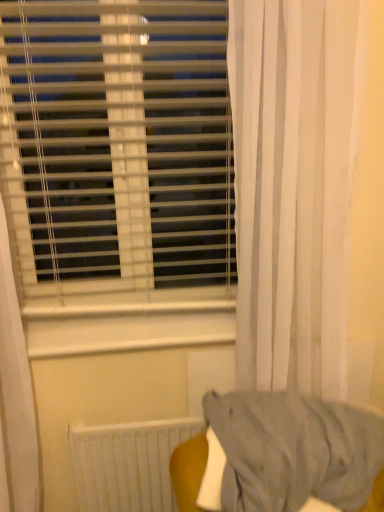
Image resolution: width=384 pixels, height=512 pixels. What are the coordinates of `white matte radiator at lower center` in the screenshot? It's located at (128, 464).

What is the approximate height of white sheer curtain at right?

white sheer curtain at right is 1.09 meters in height.

What are the coordinates of `white matte radiator at lower center` in the screenshot? It's located at (128, 464).

Is white sheer curtain at right spatially inside white matte radiator at lower center, or outside of it?

white sheer curtain at right is not inside white matte radiator at lower center, it's outside.

Which object is positioned more to the left, white sheer curtain at right or white matte radiator at lower center?

Positioned to the left is white matte radiator at lower center.

Does white sheer curtain at right have a lesser height compared to white matte radiator at lower center?

Incorrect, the height of white sheer curtain at right does not fall short of that of white matte radiator at lower center.

Is the depth of white sheer curtain at right greater than that of white matte radiator at lower center?

No, the depth of white sheer curtain at right is less than that of white matte radiator at lower center.

From the image's perspective, which one is positioned lower, white matte radiator at lower center or white plastic blinds at upper left?

white matte radiator at lower center is shown below in the image.

I want to click on radiator located on the right of white plastic blinds at upper left, so click(x=128, y=464).

How different are the orientations of white matte radiator at lower center and white plastic blinds at upper left in degrees?

The angular difference between white matte radiator at lower center and white plastic blinds at upper left is 0.33 degrees.

Considering the relative sizes of white matte radiator at lower center and white plastic blinds at upper left in the image provided, is white matte radiator at lower center thinner than white plastic blinds at upper left?

Incorrect, the width of white matte radiator at lower center is not less than that of white plastic blinds at upper left.

Is white sheer curtain at right to the left of white plastic blinds at upper left from the viewer's perspective?

Incorrect, white sheer curtain at right is not on the left side of white plastic blinds at upper left.

What's the angular difference between white sheer curtain at right and white plastic blinds at upper left's facing directions?

The angle between the facing direction of white sheer curtain at right and the facing direction of white plastic blinds at upper left is 2.77 degrees.

Is white sheer curtain at right outside of white plastic blinds at upper left?

Yes, white sheer curtain at right is not within white plastic blinds at upper left.

Which is more distant, (x=333, y=72) or (x=121, y=55)?

The point (x=121, y=55) is farther from the camera.

Considering the relative sizes of white matte radiator at lower center and white sheer curtain at right in the image provided, is white matte radiator at lower center shorter than white sheer curtain at right?

Correct, white matte radiator at lower center is not as tall as white sheer curtain at right.

Between white matte radiator at lower center and white sheer curtain at right, which one appears on the left side from the viewer's perspective?

white matte radiator at lower center.

Is white matte radiator at lower center aimed at white sheer curtain at right?

No.

You are a GUI agent. You are given a task and a screenshot of the screen. Output one action in this format:
    pyautogui.click(x=<x>, y=<y>)
    Task: Click on the window blind located above the white matte radiator at lower center (from a real-world perspective)
    The width and height of the screenshot is (384, 512).
    Given the screenshot: What is the action you would take?
    [117, 145]

Are white plastic blinds at upper left and white matte radiator at lower center located far from each other?

No, white plastic blinds at upper left is not far away from white matte radiator at lower center.

Does point (55, 215) appear closer or farther from the camera than point (86, 465)?

Point (55, 215) appears to be farther away from the viewer than point (86, 465).

Between white plastic blinds at upper left and white matte radiator at lower center, which one is positioned in front?

white plastic blinds at upper left is in front.

Are white plastic blinds at upper left and white sheer curtain at right making contact?

No, white plastic blinds at upper left is not in contact with white sheer curtain at right.

Considering the positions of objects white plastic blinds at upper left and white sheer curtain at right in the image provided, who is more to the left, white plastic blinds at upper left or white sheer curtain at right?

white plastic blinds at upper left.

From a real-world perspective, who is located higher, white plastic blinds at upper left or white sheer curtain at right?

In real-world perspective, white plastic blinds at upper left is above.

Who is bigger, white plastic blinds at upper left or white sheer curtain at right?

Answer: white sheer curtain at right.

At what (x,y) coordinates should I click in order to perform the action: click on radiator behind the white sheer curtain at right. Please return your answer as a coordinate pair (x, y). This screenshot has height=512, width=384. Looking at the image, I should click on (128, 464).

The image size is (384, 512). What are the coordinates of `window blind located above the white matte radiator at lower center (from the image's perspective)` in the screenshot? It's located at (117, 145).

From the picture: Considering their positions, is white matte radiator at lower center positioned closer to white plastic blinds at upper left than white sheer curtain at right?

Among the two, white sheer curtain at right is located nearer to white plastic blinds at upper left.

Considering their positions, is white plastic blinds at upper left positioned further to white matte radiator at lower center than white sheer curtain at right?

Based on the image, white plastic blinds at upper left appears to be further to white matte radiator at lower center.

Looking at the image, which one is located closer to white sheer curtain at right, white plastic blinds at upper left or white matte radiator at lower center?

The object closer to white sheer curtain at right is white plastic blinds at upper left.

Based on their spatial positions, is white sheer curtain at right or white matte radiator at lower center further from white plastic blinds at upper left?

white matte radiator at lower center lies further to white plastic blinds at upper left than the other object.

Based on the photo, estimate the real-world distances between objects in this image. Which object is closer to white sheer curtain at right, white matte radiator at lower center or white plastic blinds at upper left?

white plastic blinds at upper left.

Estimate the real-world distances between objects in this image. Which object is further from white matte radiator at lower center, white sheer curtain at right or white plastic blinds at upper left?

white plastic blinds at upper left is positioned further to the anchor white matte radiator at lower center.

Image resolution: width=384 pixels, height=512 pixels. Find the location of `curtain between white plastic blinds at upper left and white matte radiator at lower center from top to bottom`. curtain between white plastic blinds at upper left and white matte radiator at lower center from top to bottom is located at coordinates (293, 186).